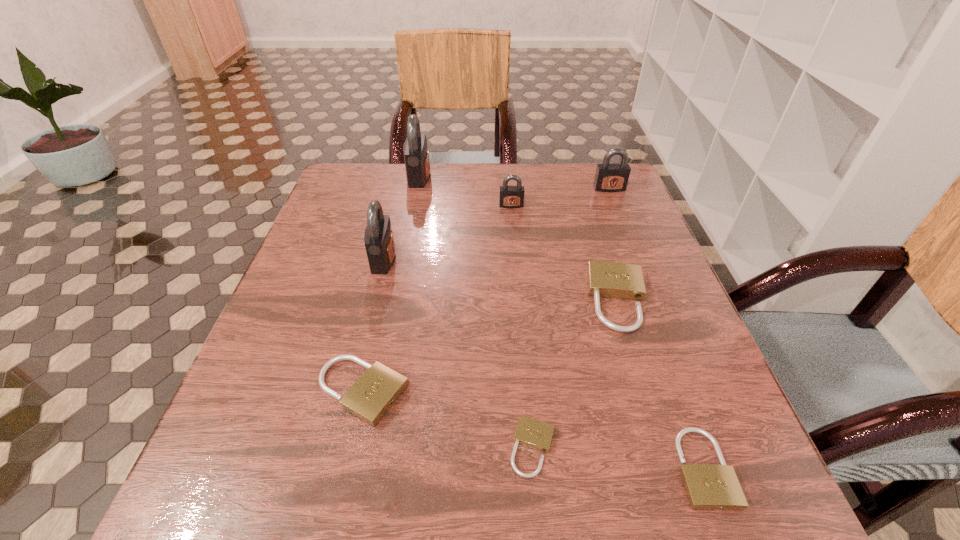
Find the location of a particular element. Image resolution: width=960 pixels, height=540 pixels. the tallest object is located at coordinates (416, 153).

Where is `the tallest padlock`? the tallest padlock is located at coordinates (416, 153).

At what (x,y) coordinates should I click in order to perform the action: click on the nearest gray padlock. Please return your answer as a coordinate pair (x, y). Looking at the image, I should click on (379, 241).

The height and width of the screenshot is (540, 960). Find the location of `the seventh shortest object`. the seventh shortest object is located at coordinates (379, 241).

Locate an element on the screen. the third biggest gray padlock is located at coordinates tap(610, 177).

Identify the location of the sixth shortest object. (610, 177).

The image size is (960, 540). I want to click on the sixth nearest object, so click(x=509, y=196).

Locate an element on the screen. The width and height of the screenshot is (960, 540). the second nearest gray padlock is located at coordinates (509, 196).

Locate an element on the screen. This screenshot has height=540, width=960. the fifth tallest padlock is located at coordinates (617, 280).

Identify the location of the fifth tallest object. The image size is (960, 540). (617, 280).